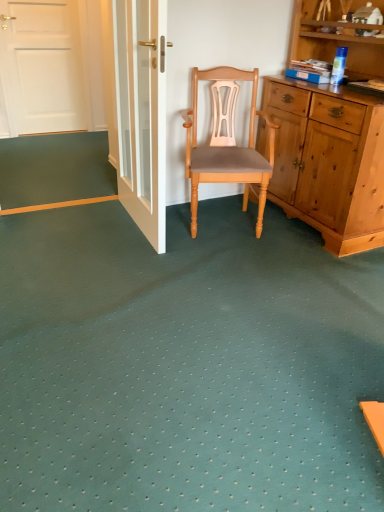
Question: Is orange matte strip at lower left at the right side of light brown wood chair at center?

Choices:
 (A) yes
 (B) no

Answer: (B)

Question: Is the depth of orange matte strip at lower left greater than that of light brown wood chair at center?

Choices:
 (A) yes
 (B) no

Answer: (A)

Question: Does orange matte strip at lower left have a lesser width compared to light brown wood chair at center?

Choices:
 (A) yes
 (B) no

Answer: (B)

Question: Is orange matte strip at lower left positioned in front of light brown wood chair at center?

Choices:
 (A) yes
 (B) no

Answer: (B)

Question: From the image's perspective, is orange matte strip at lower left located above light brown wood chair at center?

Choices:
 (A) no
 (B) yes

Answer: (A)

Question: Is orange matte strip at lower left not within light brown wood chair at center?

Choices:
 (A) no
 (B) yes

Answer: (B)

Question: From a real-world perspective, is orange matte strip at lower left physically below white glossy door at upper center?

Choices:
 (A) yes
 (B) no

Answer: (A)

Question: Does orange matte strip at lower left lie behind white glossy door at upper center?

Choices:
 (A) no
 (B) yes

Answer: (B)

Question: Is orange matte strip at lower left with white glossy door at upper center?

Choices:
 (A) no
 (B) yes

Answer: (A)

Question: From a real-world perspective, is orange matte strip at lower left on white glossy door at upper center?

Choices:
 (A) yes
 (B) no

Answer: (B)

Question: Does orange matte strip at lower left have a lesser height compared to white glossy door at upper center?

Choices:
 (A) no
 (B) yes

Answer: (B)

Question: Does orange matte strip at lower left turn towards white glossy door at upper center?

Choices:
 (A) no
 (B) yes

Answer: (A)

Question: Is light brown wood chair at center facing away from white glossy door at upper center?

Choices:
 (A) no
 (B) yes

Answer: (A)